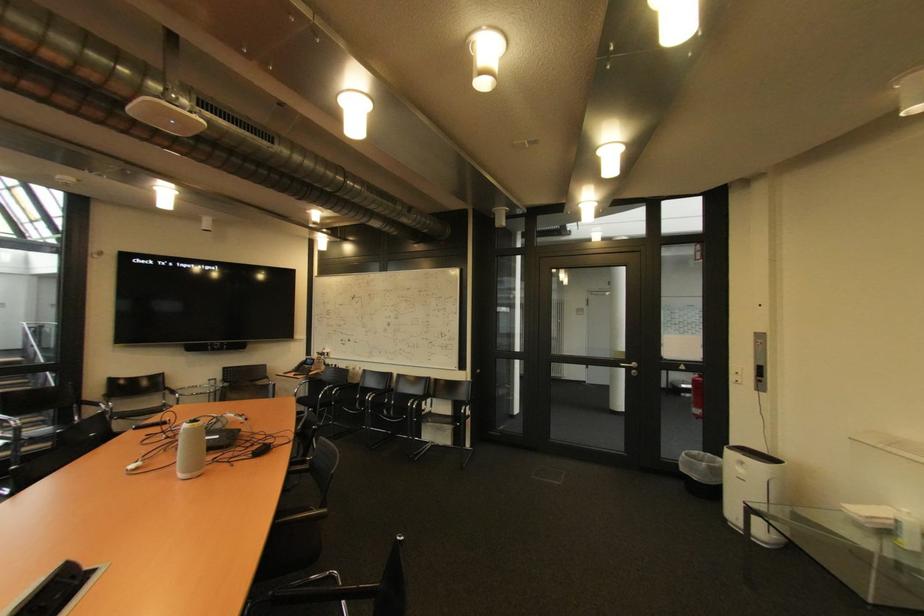
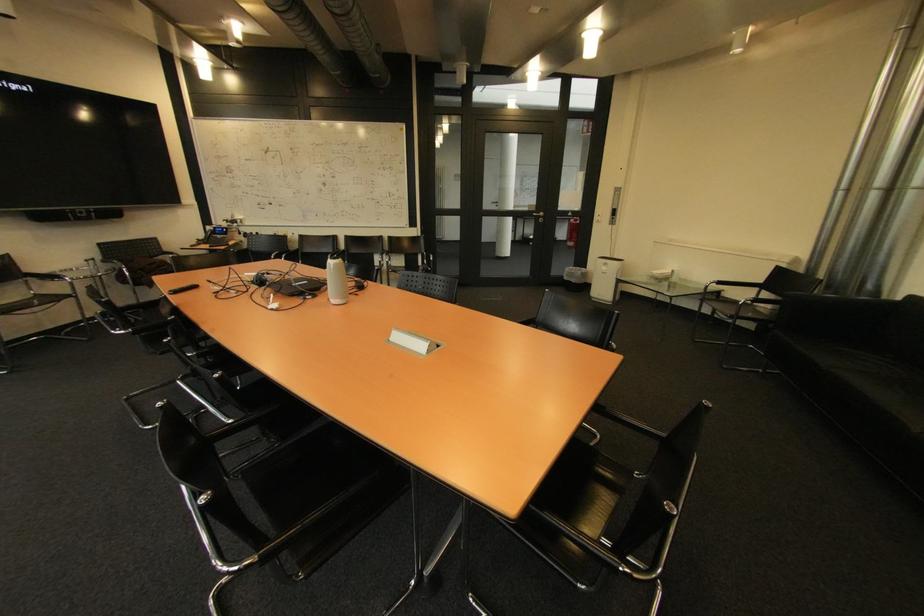
In the second image, find the point that corresponds to the point at 748,471 in the first image.

(613, 270)